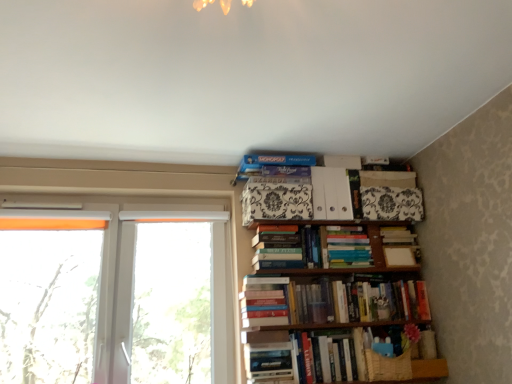
Question: Does black and white patterned box at upper center, placed as the third paperback book when sorted from right to left, appear on the right side of hardcover book at center, which is the 3th book from top to bottom?

Choices:
 (A) yes
 (B) no

Answer: (B)

Question: From the image's perspective, would you say black and white patterned box at upper center, which appears as the first paperback book when viewed from the left, is positioned over hardcover book at center, which appears as the seventh book when ordered from the bottom?

Choices:
 (A) yes
 (B) no

Answer: (A)

Question: Does black and white patterned box at upper center, placed as the third paperback book when sorted from right to left, have a greater height compared to hardcover book at center, which appears as the seventh book when ordered from the bottom?

Choices:
 (A) yes
 (B) no

Answer: (B)

Question: Is black and white patterned box at upper center, which appears as the first paperback book when viewed from the left, thinner than hardcover book at center, which is the 3th book from top to bottom?

Choices:
 (A) yes
 (B) no

Answer: (B)

Question: Is black and white patterned box at upper center, which appears as the first paperback book when viewed from the left, further to camera compared to hardcover book at center, which is the 3th book from top to bottom?

Choices:
 (A) yes
 (B) no

Answer: (B)

Question: Does black and white patterned box at upper center, placed as the third paperback book when sorted from right to left, have a smaller size compared to hardcover book at center, which appears as the seventh book when ordered from the bottom?

Choices:
 (A) yes
 (B) no

Answer: (B)

Question: From a real-world perspective, is hardcover book at center, which is counted as the 1th book, starting from the bottom, positioned under hardcover book at lower right, arranged as the 3th book when ordered from the bottom, based on gravity?

Choices:
 (A) no
 (B) yes

Answer: (B)

Question: Is hardcover book at center, which is counted as the 1th book, starting from the bottom, at the left side of hardcover book at lower right, the seventh book positioned from the top?

Choices:
 (A) no
 (B) yes

Answer: (B)

Question: Could you tell me if hardcover book at center, which is counted as the 1th book, starting from the bottom, is facing hardcover book at lower right, arranged as the 3th book when ordered from the bottom?

Choices:
 (A) yes
 (B) no

Answer: (A)

Question: Is hardcover book at center, the 9th book positioned from the top, closer to the viewer compared to hardcover book at lower right, the seventh book positioned from the top?

Choices:
 (A) yes
 (B) no

Answer: (B)

Question: From a real-world perspective, is hardcover book at center, the 9th book positioned from the top, physically above hardcover book at lower right, arranged as the 3th book when ordered from the bottom?

Choices:
 (A) no
 (B) yes

Answer: (A)

Question: Can you confirm if hardcover book at center, the 9th book positioned from the top, is wider than hardcover book at lower right, the seventh book positioned from the top?

Choices:
 (A) yes
 (B) no

Answer: (B)

Question: Can you confirm if transparent plastic window at left, the 3th window positioned from the left, is taller than blue cardboard game at upper center, which appears as the 9th book when ordered from the bottom?

Choices:
 (A) yes
 (B) no

Answer: (A)